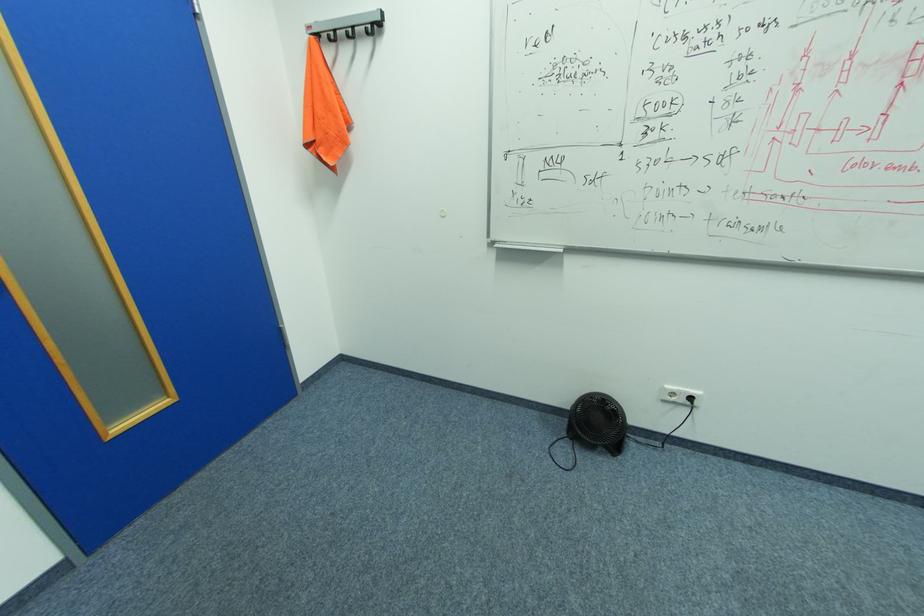
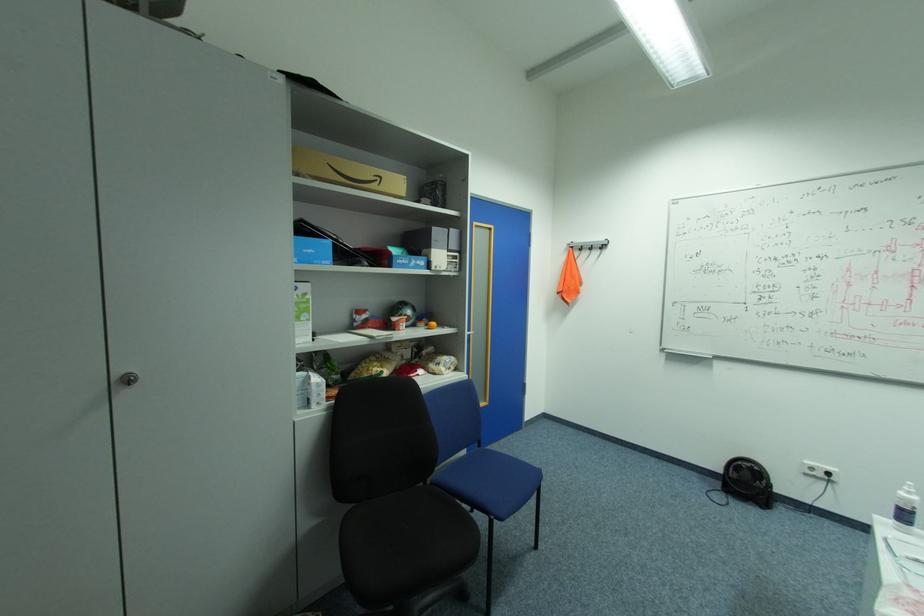
Find the pixel in the second image that matches point (324, 34) in the first image.

(578, 246)